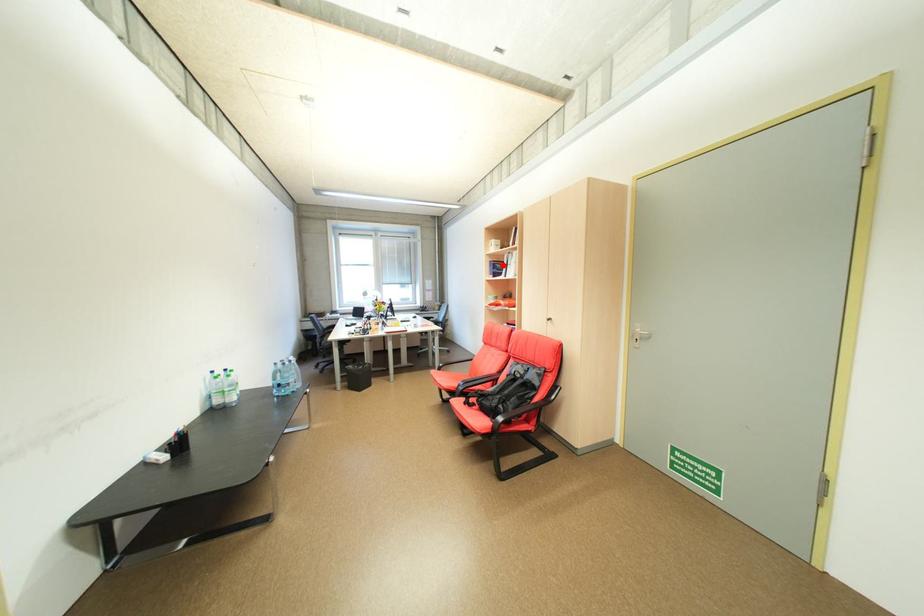
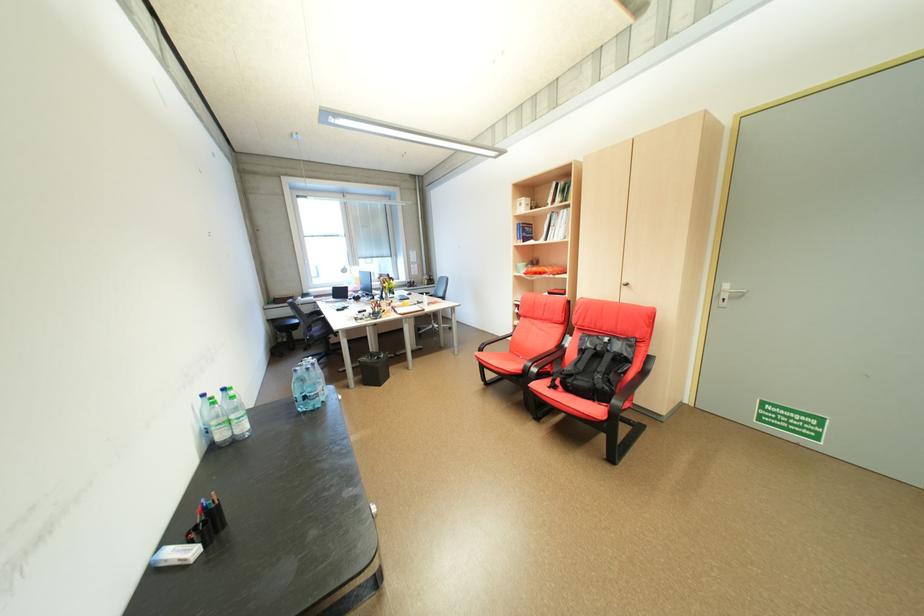
In the second image, find the point that corresponds to the highlighted location in the first image.

(532, 228)